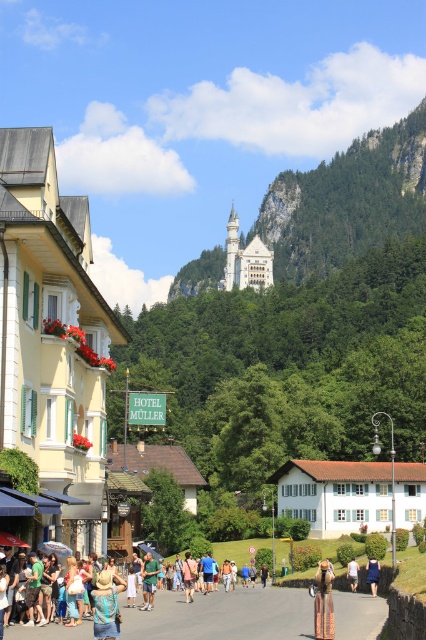
You are a traveler standing on the street in front of the Hotel M?ller. You notice the green forested mountain at upper center and the light brown woven bag at center. Which object is higher in the scene?

The green forested mountain at upper center is taller than the light brown woven bag at center.

You are a tour guide leading a group through the village. You notice a light brown woven bag at center and a tan leather jacket at center. If your group wants to move from the bag to the jacket, will they have enough space to walk comfortably? Please explain.

The distance between the light brown woven bag at center and the tan leather jacket at center is 21.62 feet, which is more than enough space for the group to move comfortably from the bag to the jacket.